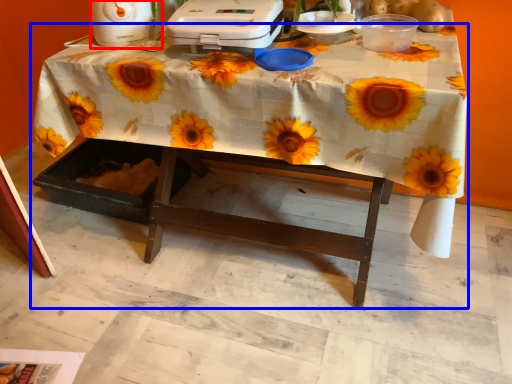
Question: Among these objects, which one is farthest to the camera, appliance (highlighted by a red box) or table (highlighted by a blue box)?

Choices:
 (A) appliance
 (B) table

Answer: (A)